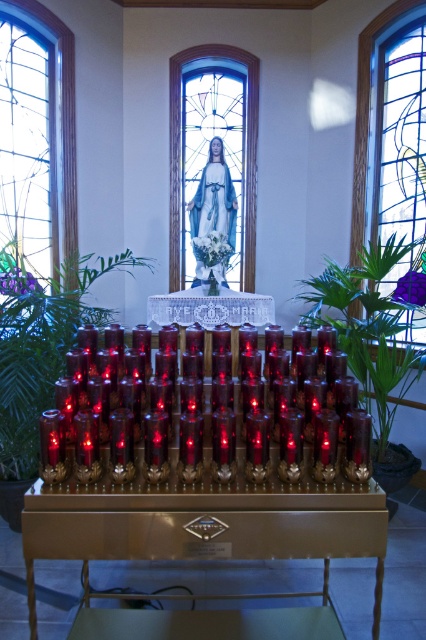
You are a visitor to the church and want to place a small offering on the altar table. You notice the green leafy plant at center and the blue glass at center. Which object is closer to you if you are standing in front of the altar table?

The green leafy plant at center is closer to you because it is in front of the blue glass at center.

In the scene shown: You are an interior designer planning to install a new light fixture between the clear glass stained glass at left and the blue glass at center. Based on their positions, which glass will the light fixture be closer to?

The clear glass stained glass at left is closer to the viewer than the blue glass at center, so the light fixture will be closer to the clear glass stained glass at left.